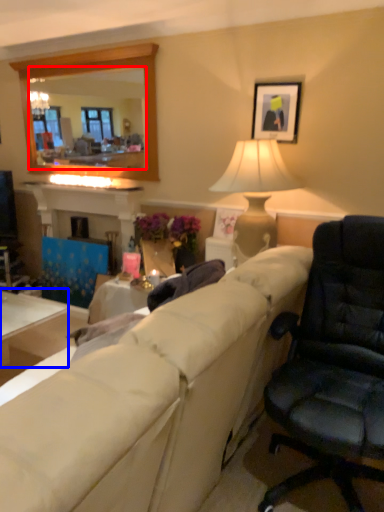
Question: Which object is further to the camera taking this photo, mirror (highlighted by a red box) or table (highlighted by a blue box)?

Choices:
 (A) mirror
 (B) table

Answer: (A)